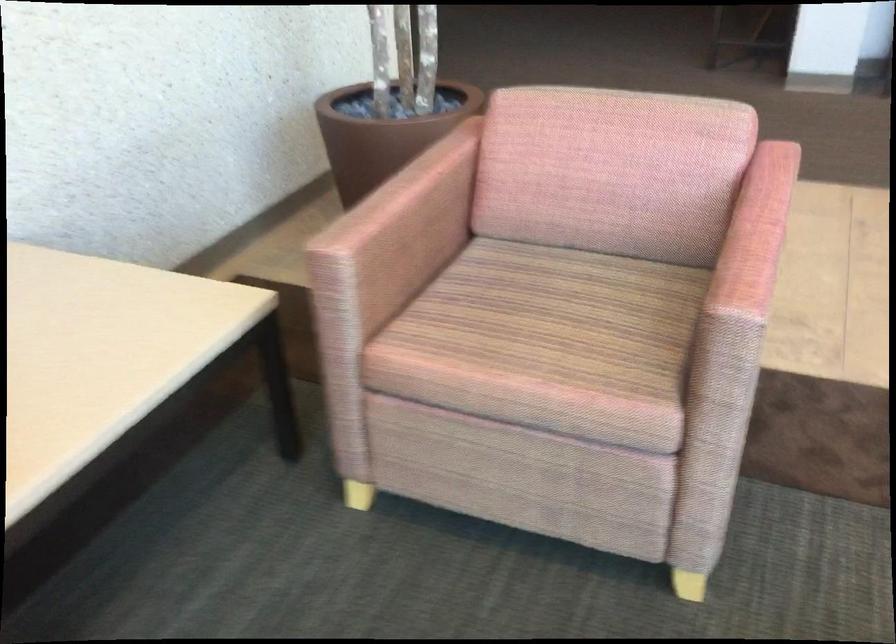
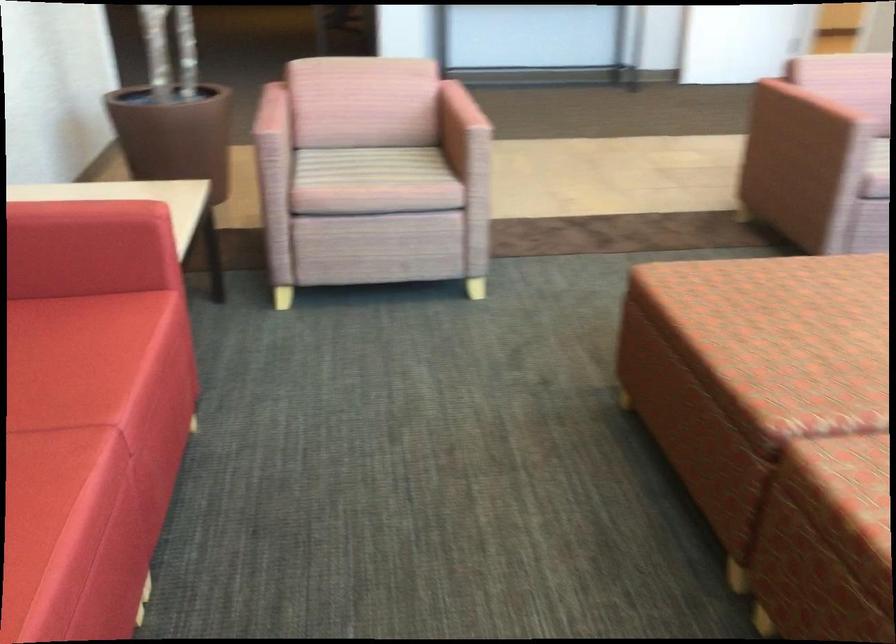
In the second image, find the point that corresponds to point 521,321 in the first image.

(365, 166)